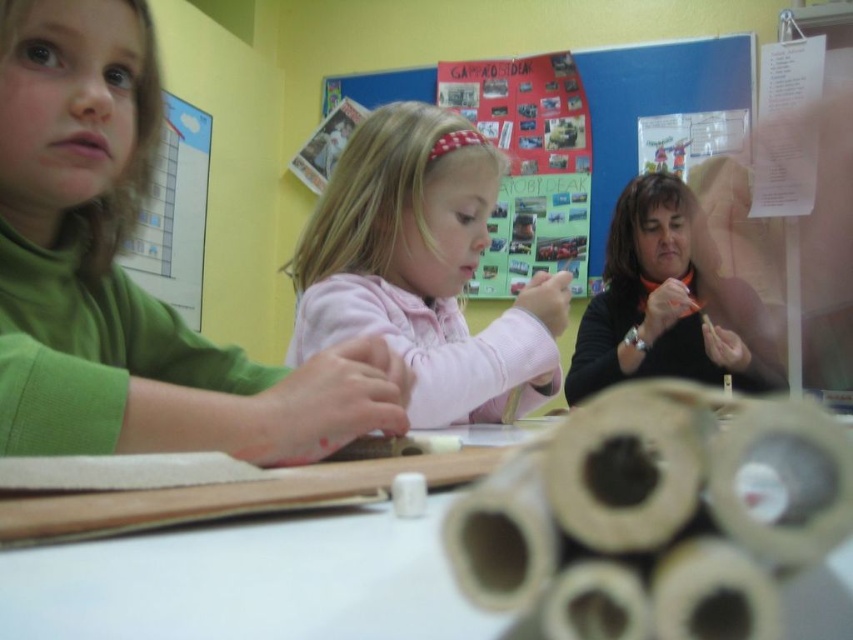
Looking at the classroom scene, where is the multicolored paper collage at upper center in relation to the black matte sweater at upper right?

The multicolored paper collage at upper center is to the left of the black matte sweater at upper right.

You are a teacher in the classroom and want to hand out craft supplies. You are standing at the front of the classroom. Which object, the pink fleece jacket at center or the black matte sweater at upper right, is closer to you?

The black matte sweater at upper right is closer to you because it is positioned at upper right, which is typically closer in such scenes compared to the center position.